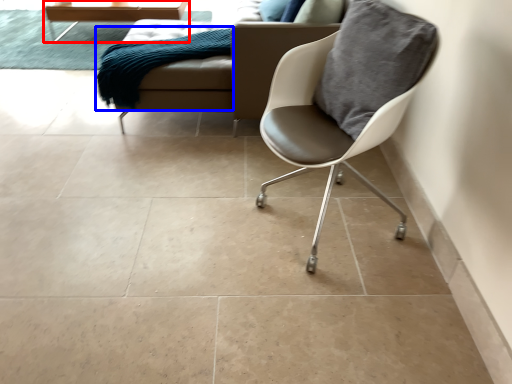
Question: Among these objects, which one is nearest to the camera, table (highlighted by a red box) or material (highlighted by a blue box)?

Choices:
 (A) table
 (B) material

Answer: (B)